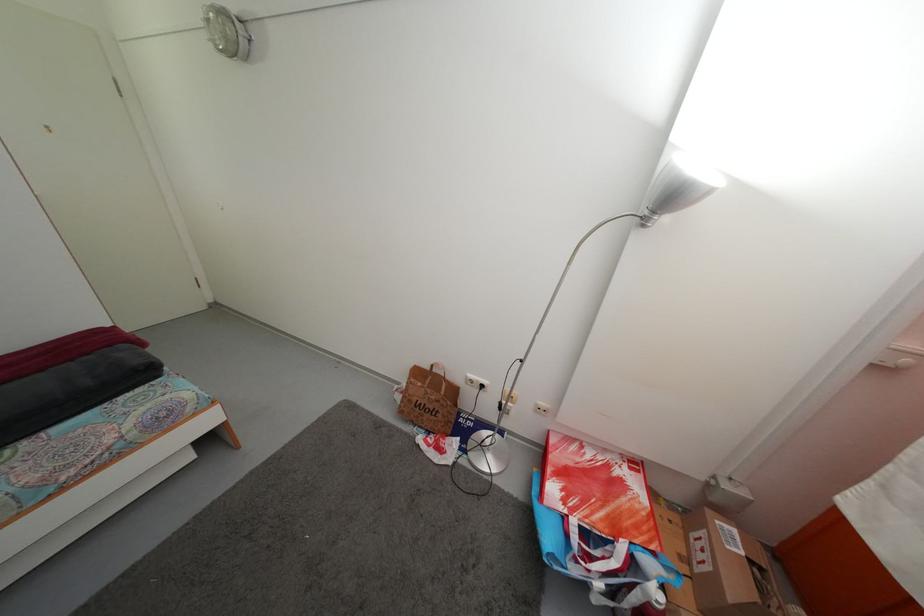
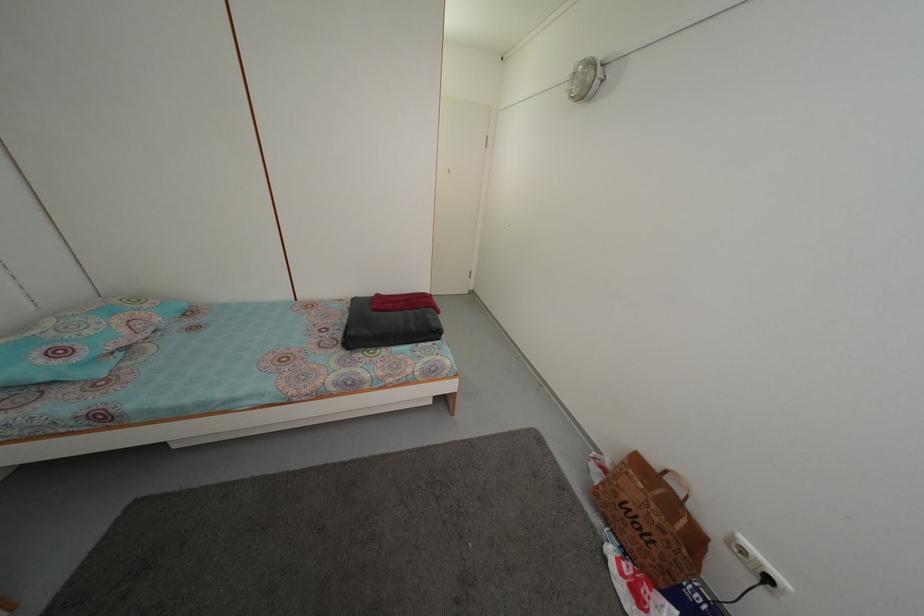
Question: The camera is either moving clockwise (left) or counter-clockwise (right) around the object. The first image is from the beginning of the video and the second image is from the end. Is the camera moving left or right when shooting the video?

Choices:
 (A) Left
 (B) Right

Answer: (B)